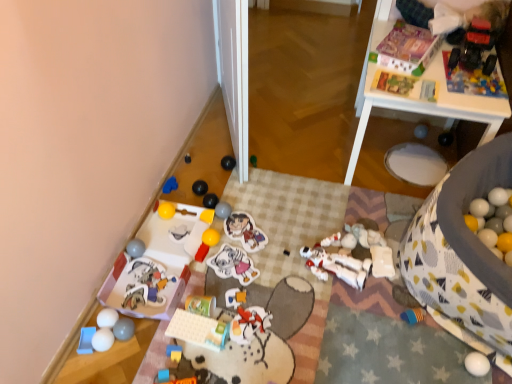
Find the location of a particular element. This screenshot has width=512, height=384. free space behind smooth plastic balls at lower left, marked as the 4th toy in a left-to-right arrangement is located at coordinates (141, 294).